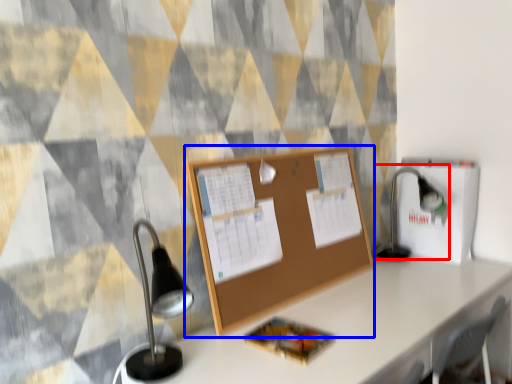
Question: Which object appears closest to the camera in this image, table lamp (highlighted by a red box) or bulletin board (highlighted by a blue box)?

Choices:
 (A) table lamp
 (B) bulletin board

Answer: (B)